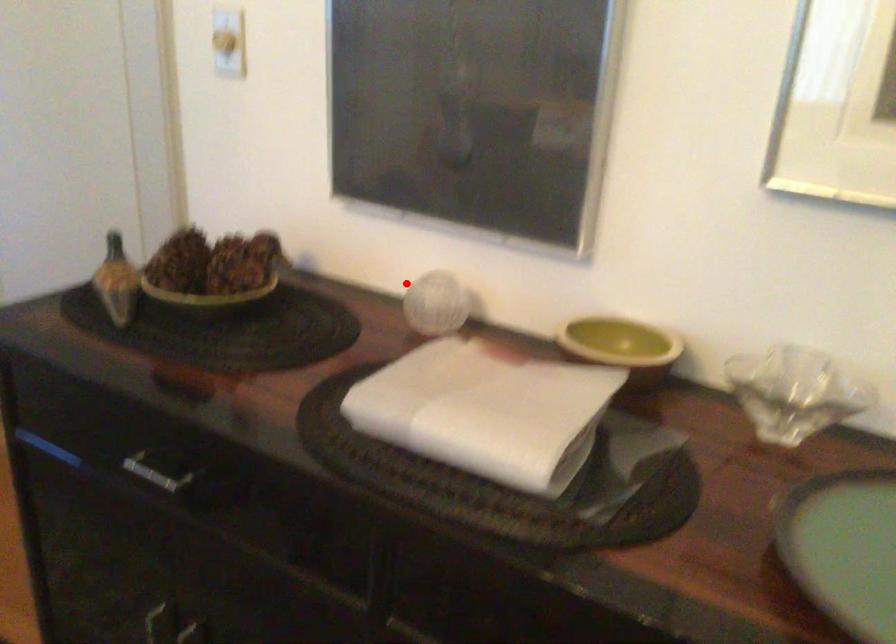
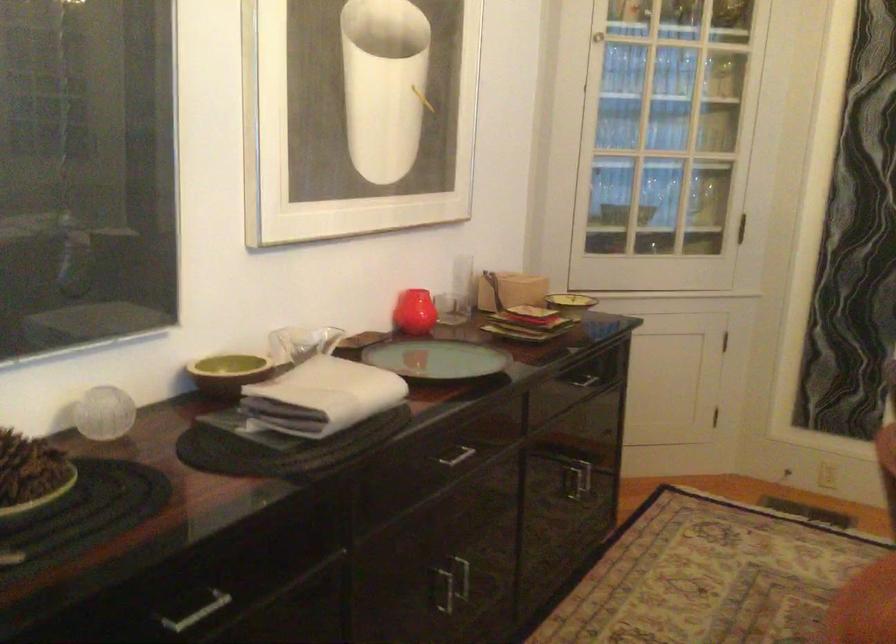
In the second image, find the point that corresponds to the highlighted location in the first image.

(104, 413)